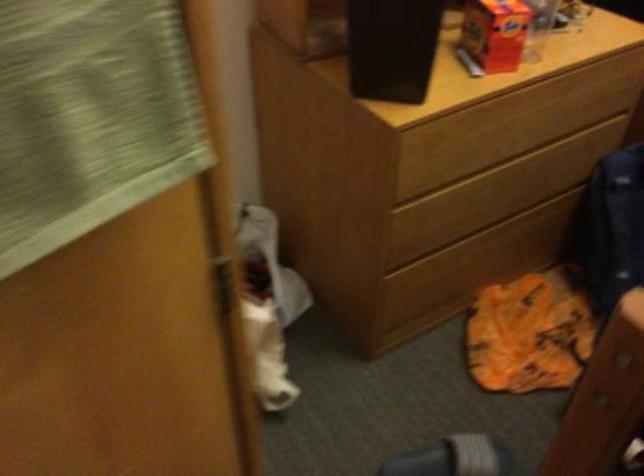
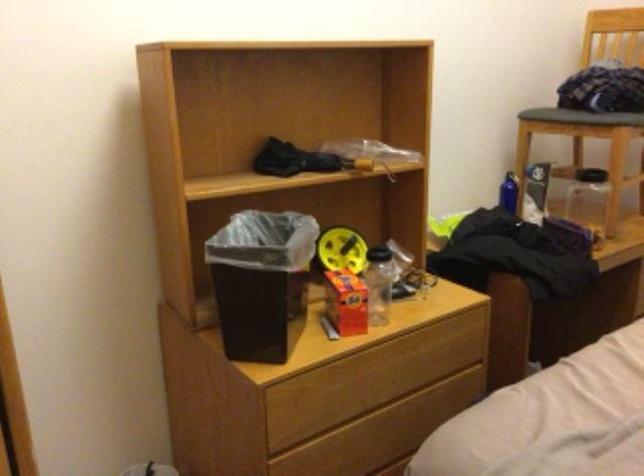
The point at (x=500, y=163) is marked in the first image. Where is the corresponding point in the second image?

(365, 413)